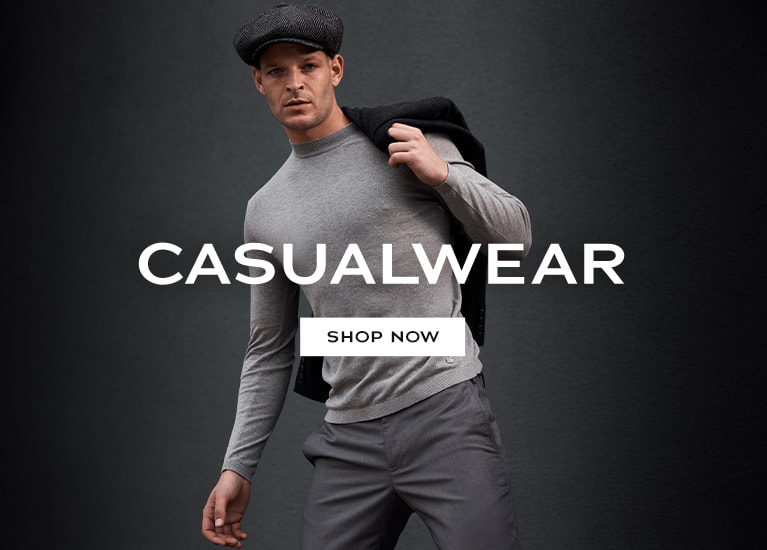
Locate an element on the screen. The image size is (767, 550). box is located at coordinates (311, 326).